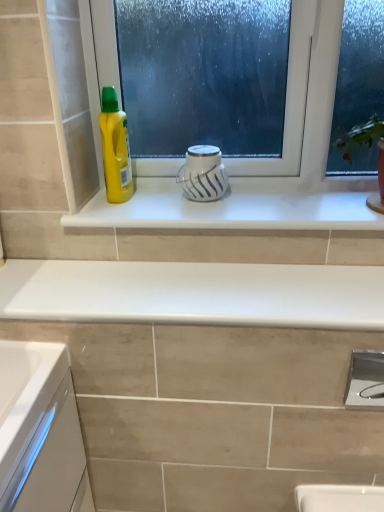
At what (x,y) coordinates should I click in order to perform the action: click on empty space that is ontop of white glossy countertop at center. Please return your answer as a coordinate pair (x, y). Looking at the image, I should click on (167, 283).